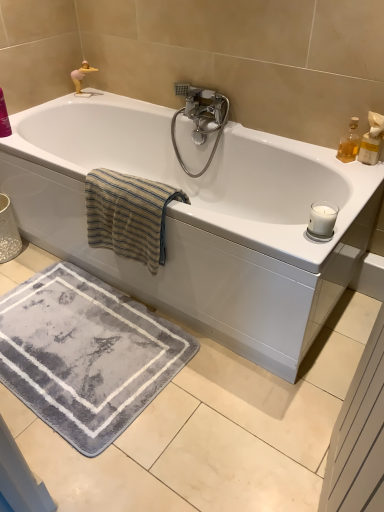
Locate an element on the screen. free location to the left of translucent amber glass at upper right is located at coordinates (319, 155).